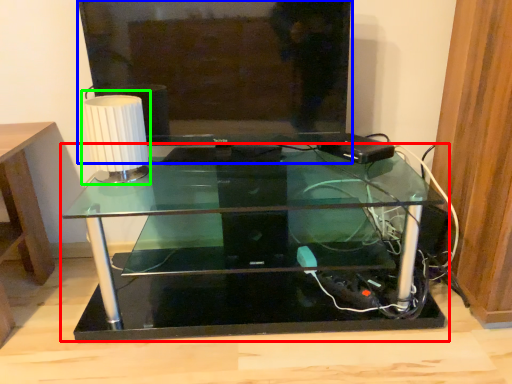
Question: Which object is the farthest from table (highlighted by a red box)? Choose among these: television (highlighted by a blue box) or table lamp (highlighted by a green box).

Choices:
 (A) television
 (B) table lamp

Answer: (B)